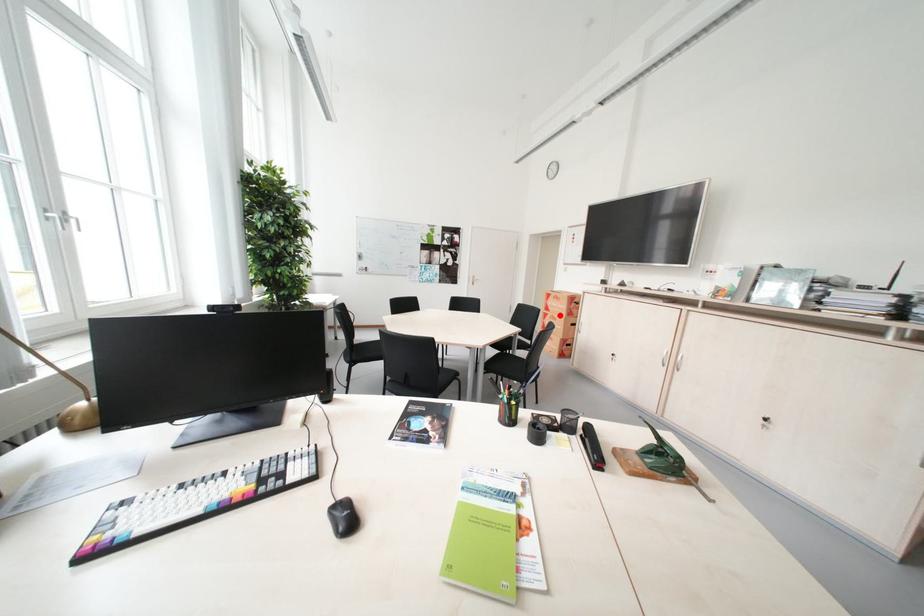
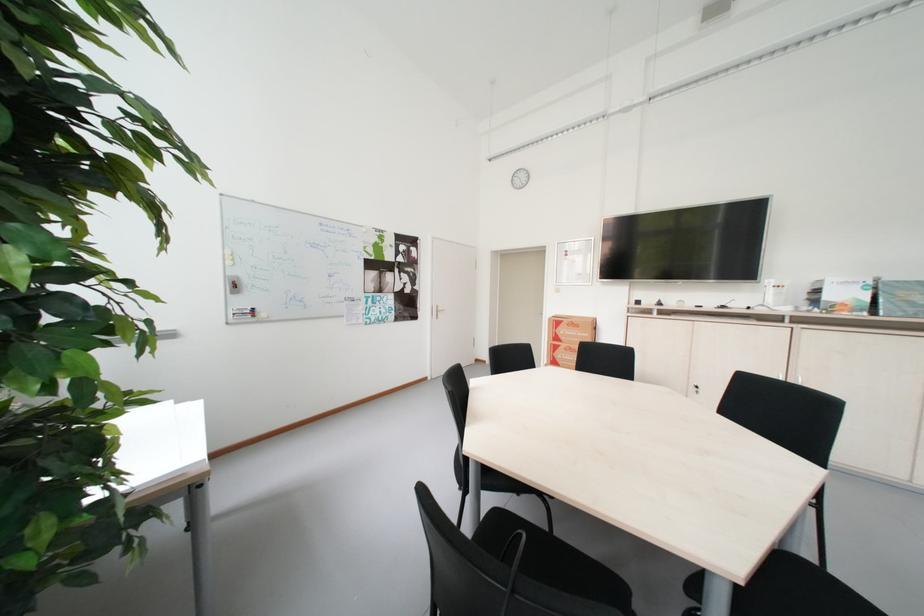
The point at the highlighted location is marked in the first image. Where is the corresponding point in the second image?

(573, 347)